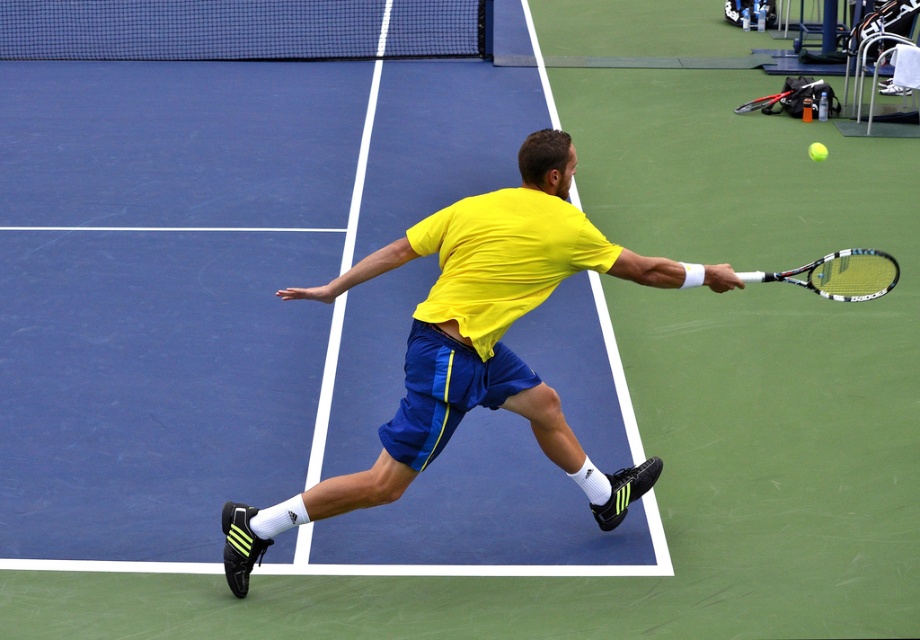
Question: Which point is closer to the camera?

Choices:
 (A) white matte tennis racket at center
 (B) green rubber tennis ball at upper right

Answer: (A)

Question: Can you confirm if white matte tennis racket at center is positioned to the right of green rubber tennis ball at upper right?

Choices:
 (A) no
 (B) yes

Answer: (A)

Question: Can you confirm if yellow matte shirt at center is thinner than green rubber tennis ball at upper right?

Choices:
 (A) yes
 (B) no

Answer: (B)

Question: Which of these objects is positioned closest to the yellow matte shirt at center?

Choices:
 (A) white matte tennis racket at center
 (B) green rubber tennis ball at upper right

Answer: (A)

Question: Estimate the real-world distances between objects in this image. Which object is closer to the green rubber tennis ball at upper right?

Choices:
 (A) white matte tennis racket at center
 (B) yellow matte shirt at center

Answer: (A)

Question: Can you confirm if white matte tennis racket at center is wider than green rubber tennis ball at upper right?

Choices:
 (A) yes
 (B) no

Answer: (A)